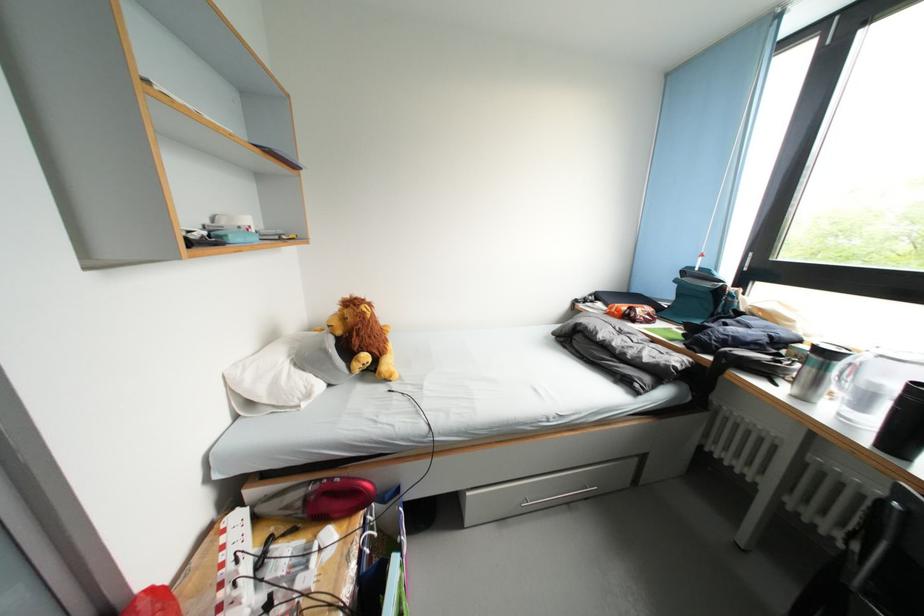
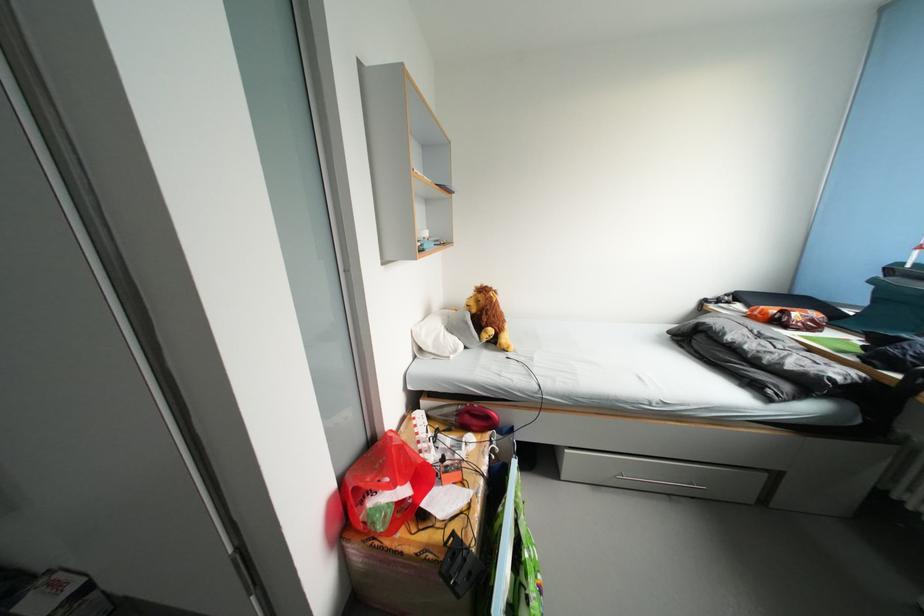
The point at [347,338] is marked in the first image. Where is the corresponding point in the second image?

(482, 315)